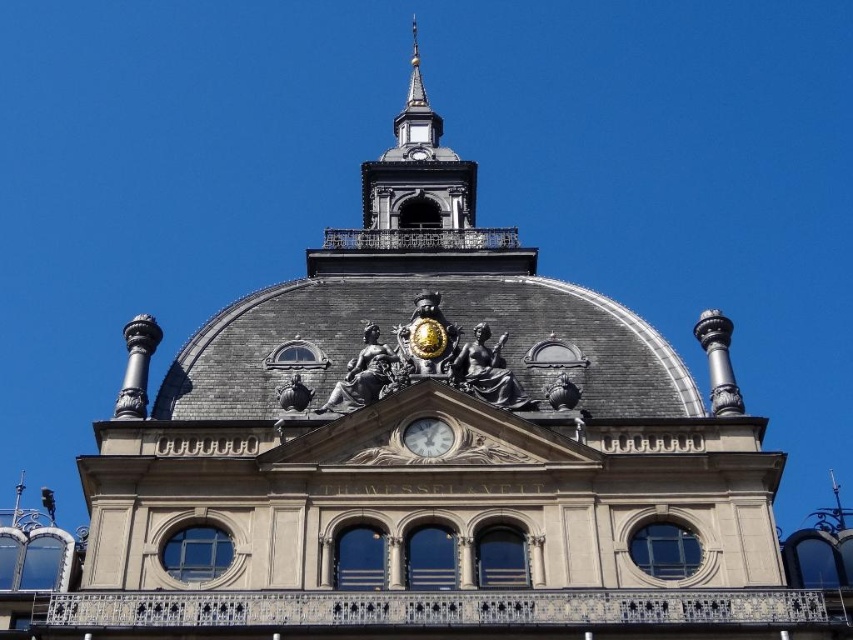
Question: Is polished bronze statue at center bigger than bronze statue at center?

Choices:
 (A) no
 (B) yes

Answer: (A)

Question: Is polished bronze dome at center thinner than white glossy clock at center?

Choices:
 (A) no
 (B) yes

Answer: (A)

Question: Which object is positioned closest to the bronze statue at center?

Choices:
 (A) polished bronze statue at center
 (B) white glossy clock at center

Answer: (B)

Question: Which of these objects is positioned closest to the polished bronze dome at center?

Choices:
 (A) shiny bronze statue at center
 (B) polished bronze statue at center
 (C) matte bronze sphere at center
 (D) bronze statue at center

Answer: (D)

Question: Observing the image, what is the correct spatial positioning of polished bronze dome at center in reference to white glossy clock at center?

Choices:
 (A) above
 (B) below

Answer: (A)

Question: Which point appears farthest from the camera in this image?

Choices:
 (A) (492, 348)
 (B) (515, 356)
 (C) (297, 376)

Answer: (B)